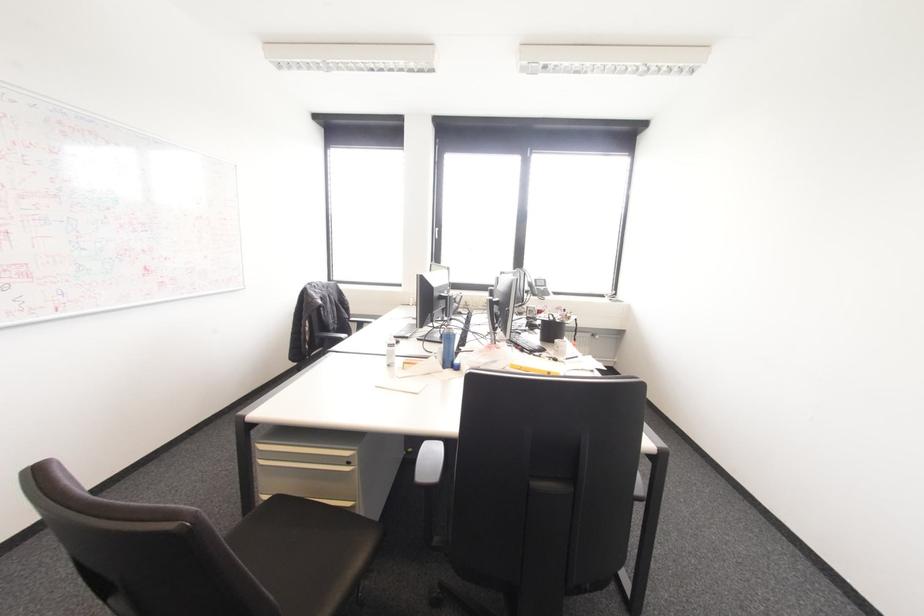
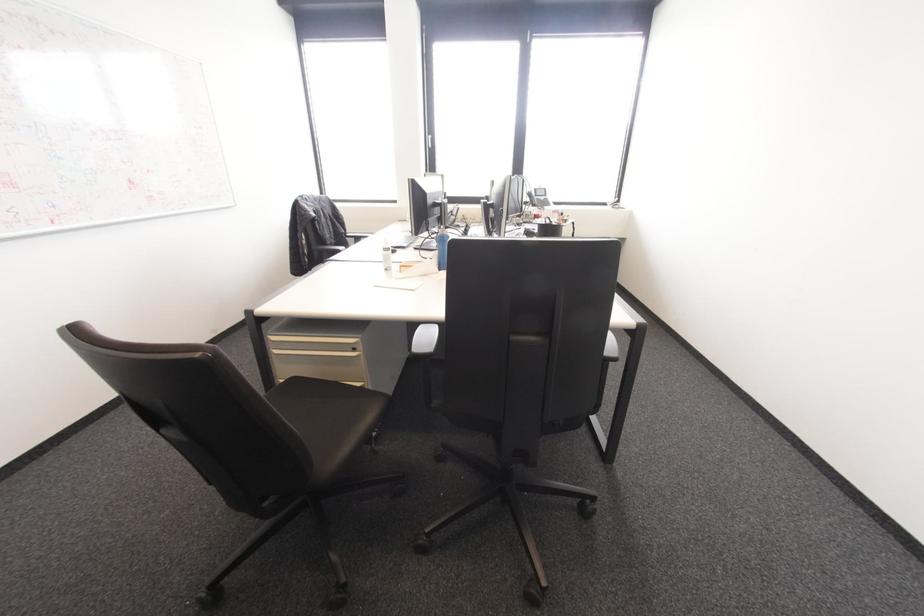
In the second image, find the point that corresponds to (x=430, y=461) in the first image.

(426, 339)